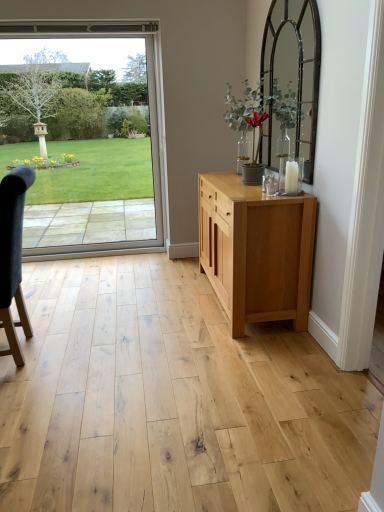
The width and height of the screenshot is (384, 512). I want to click on vacant space in front of natural wood cabinet at center, so click(243, 364).